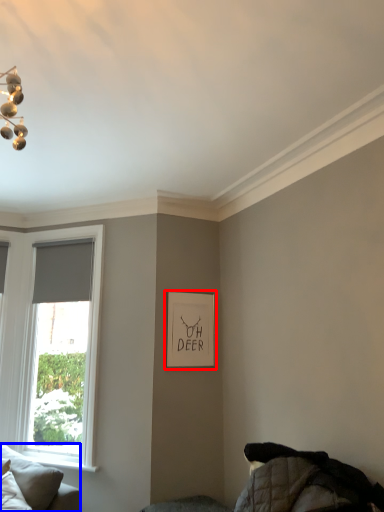
Question: Among these objects, which one is farthest to the camera, picture frame (highlighted by a red box) or studio couch (highlighted by a blue box)?

Choices:
 (A) picture frame
 (B) studio couch

Answer: (A)